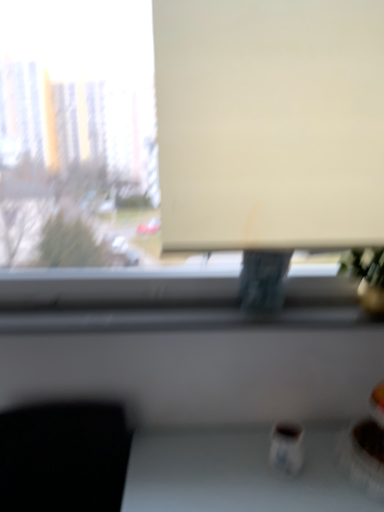
This screenshot has width=384, height=512. Describe the element at coordinates (270, 123) in the screenshot. I see `matte white screen at center` at that location.

This screenshot has width=384, height=512. In order to click on matte white screen at center in this screenshot , I will do `click(270, 123)`.

What is the approximate height of matte white screen at center?

The height of matte white screen at center is 73.13 centimeters.

The image size is (384, 512). What do you see at coordinates (187, 146) in the screenshot?
I see `white matte window at upper center` at bounding box center [187, 146].

Image resolution: width=384 pixels, height=512 pixels. Find the location of `white matte window at upper center`. white matte window at upper center is located at coordinates (187, 146).

Measure the distance between point (227,126) and camera.

Point (227,126) is 1.28 meters from camera.

Image resolution: width=384 pixels, height=512 pixels. What are the coordinates of `matte white screen at center` in the screenshot? It's located at (270, 123).

Which object is positioned more to the left, white matte window at upper center or matte white screen at center?

Positioned to the left is white matte window at upper center.

Is white matte window at upper center in front of matte white screen at center?

Yes.

In the scene shown: Which point is more forward, (303, 142) or (232, 238)?

The point (303, 142) is closer.

From the image's perspective, which object appears higher, white matte window at upper center or matte white screen at center?

matte white screen at center appears higher in the image.

Based on the photo, from a real-world perspective, which is physically above, white matte window at upper center or matte white screen at center?

In real-world perspective, matte white screen at center is above.

Is white matte window at upper center wider or thinner than matte white screen at center?

In the image, white matte window at upper center appears to be wider than matte white screen at center.

Is white matte window at upper center shorter than matte white screen at center?

No, white matte window at upper center is not shorter than matte white screen at center.

In the scene shown: Does white matte window at upper center have a larger size compared to matte white screen at center?

Yes, white matte window at upper center is bigger than matte white screen at center.

Is matte white screen at center surrounded by white matte window at upper center?

Yes.

Is white matte window at upper center not near matte white screen at center?

Yes.

Could you tell me if white matte window at upper center is turned towards matte white screen at center?

Yes, white matte window at upper center is aimed at matte white screen at center.

Measure the distance from white matte window at upper center to matte white screen at center.

A distance of 1.65 meters exists between white matte window at upper center and matte white screen at center.

This screenshot has height=512, width=384. I want to click on window on the left of matte white screen at center, so click(x=187, y=146).

Between matte white screen at center and white matte window at upper center, which one appears on the right side from the viewer's perspective?

matte white screen at center.

Is matte white screen at center in front of or behind white matte window at upper center in the image?

matte white screen at center is behind white matte window at upper center.

Which point is more distant from viewer, (x=199, y=71) or (x=39, y=128)?

Point (x=39, y=128)

From the image's perspective, which is below, matte white screen at center or white matte window at upper center?

white matte window at upper center is shown below in the image.

From a real-world perspective, who is located lower, matte white screen at center or white matte window at upper center?

white matte window at upper center is physically lower.

Is matte white screen at center wider than white matte window at upper center?

No, matte white screen at center is not wider than white matte window at upper center.

Which of these two, matte white screen at center or white matte window at upper center, stands shorter?

Standing shorter between the two is matte white screen at center.

Can you confirm if matte white screen at center is smaller than white matte window at upper center?

Correct, matte white screen at center occupies less space than white matte window at upper center.

Is matte white screen at center located outside white matte window at upper center?

No, matte white screen at center is inside or overlapping with white matte window at upper center.

Is matte white screen at center next to white matte window at upper center and touching it?

There is a gap between matte white screen at center and white matte window at upper center.

Is matte white screen at center oriented towards white matte window at upper center?

Yes, matte white screen at center is oriented towards white matte window at upper center.

How different are the orientations of matte white screen at center and white matte window at upper center in degrees?

The angular difference between matte white screen at center and white matte window at upper center is 0.000196 degrees.

The image size is (384, 512). Find the location of `projection screen that is behind the white matte window at upper center`. projection screen that is behind the white matte window at upper center is located at coordinates (270, 123).

The image size is (384, 512). I want to click on window below the matte white screen at center (from a real-world perspective), so click(187, 146).

Identify the location of window below the matte white screen at center (from the image's perspective). Image resolution: width=384 pixels, height=512 pixels. (187, 146).